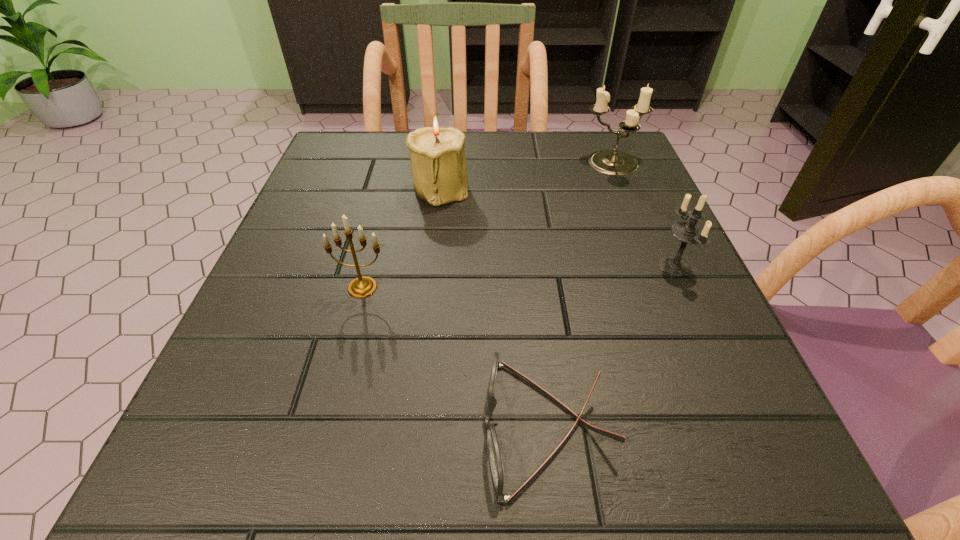
Locate an element on the screen. The height and width of the screenshot is (540, 960). object located at the left edge is located at coordinates (363, 286).

At what (x,y) coordinates should I click in order to perform the action: click on object positioned at the far right corner. Please return your answer as a coordinate pair (x, y). Image resolution: width=960 pixels, height=540 pixels. Looking at the image, I should click on (611, 162).

Identify the location of free region at the far edge of the desktop. This screenshot has width=960, height=540. (513, 163).

The image size is (960, 540). In the image, there is a desktop. Identify the location of blank space at the near edge. (425, 490).

In the image, there is a desktop. Where is `vacant region at the left edge`? vacant region at the left edge is located at coordinates (318, 254).

The width and height of the screenshot is (960, 540). I want to click on free space at the right edge of the desktop, so click(630, 237).

In the image, there is a desktop. Where is `vacant space at the far left corner`? Image resolution: width=960 pixels, height=540 pixels. vacant space at the far left corner is located at coordinates (326, 145).

In the image, there is a desktop. Identify the location of vacant space at the near left corner. Image resolution: width=960 pixels, height=540 pixels. (163, 488).

The image size is (960, 540). What are the coordinates of `vacant space at the far right corner of the desktop` in the screenshot? It's located at (588, 136).

You are a GUI agent. You are given a task and a screenshot of the screen. Output one action in this format:
    pyautogui.click(x=<x>, y=<y>)
    Task: Click on the empty space that is in between the second candle holder from left to right and the spectacles
    The height and width of the screenshot is (540, 960).
    Given the screenshot: What is the action you would take?
    pyautogui.click(x=494, y=307)